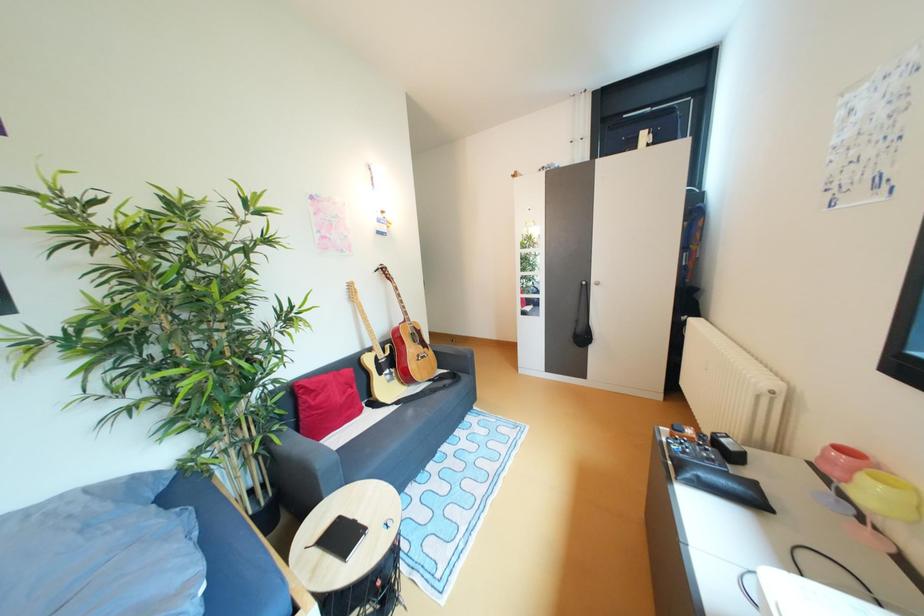
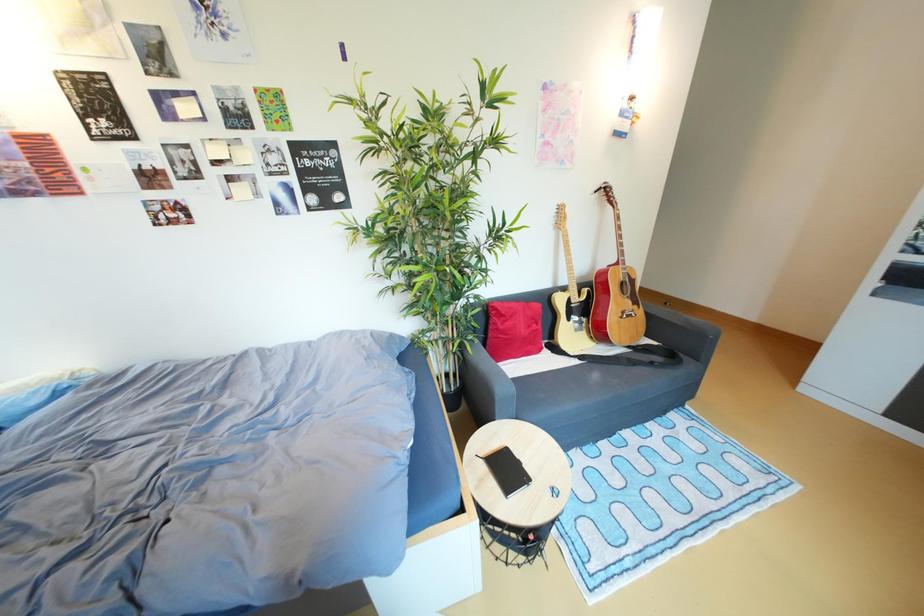
The images are taken continuously from a first-person perspective. In which direction is your viewpoint rotating?

The camera rotated toward left-down.